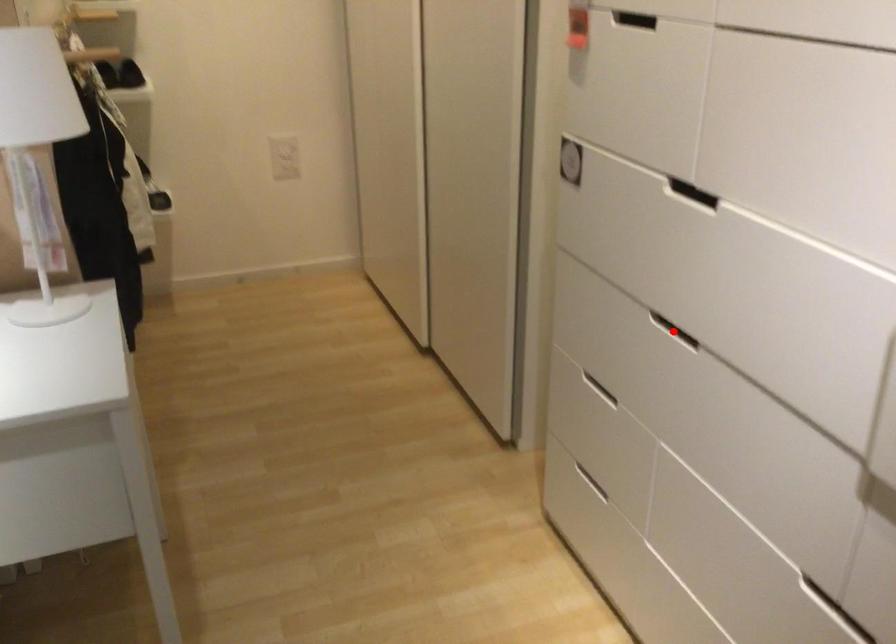
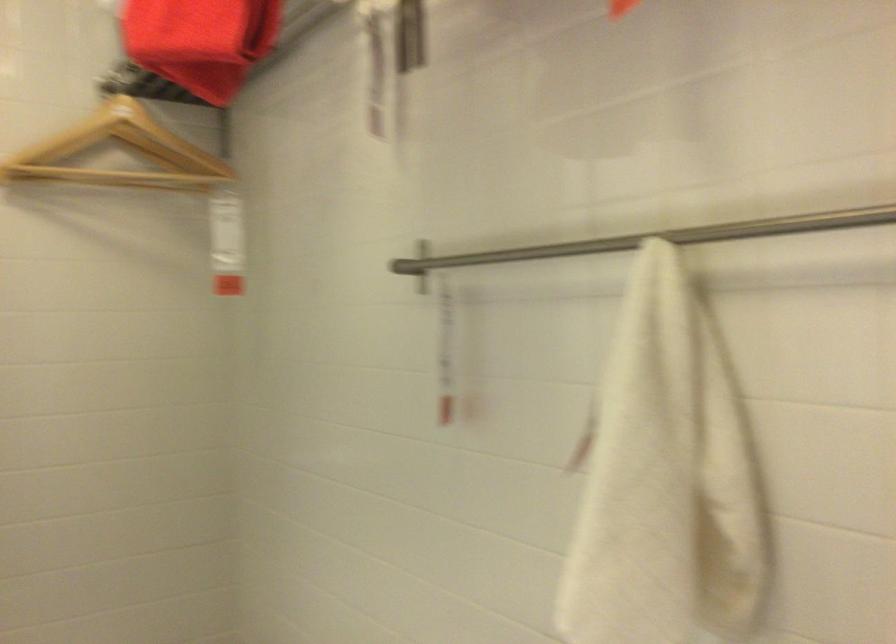
Question: I am providing you with two images of the same scene from different viewpoints. A red point is marked on the first image. Is the red point's position out of view in image 2?

Choices:
 (A) Yes
 (B) No

Answer: (A)